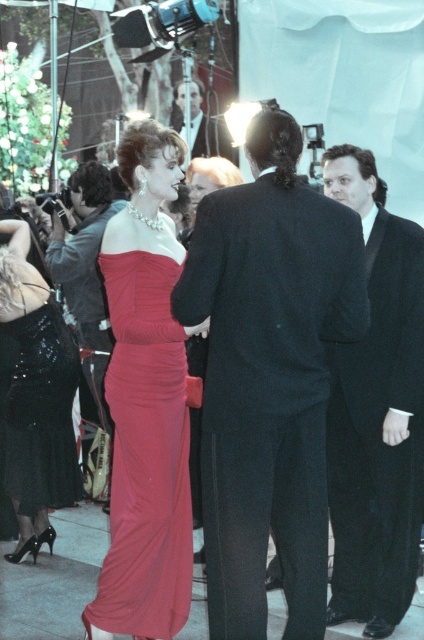
Looking at this image, you are a photographer at the event and need to capture a clear photo of both the satin red dress at center and the matte red dress at center. Which dress should you focus on first to ensure it appears sharp in the photo?

You should focus on the satin red dress at center first because it is in front of the matte red dress at center, so focusing on the front one will keep it sharp while the background may blur slightly.

You are a photographer at the event and need to capture a photo where the dress with more height is visible. Which dress should you focus on between the satin red dress at center and the matte red dress at center?

The satin red dress at center has a greater height compared to the matte red dress at center, so you should focus on the satin red dress at center to capture its visibility.